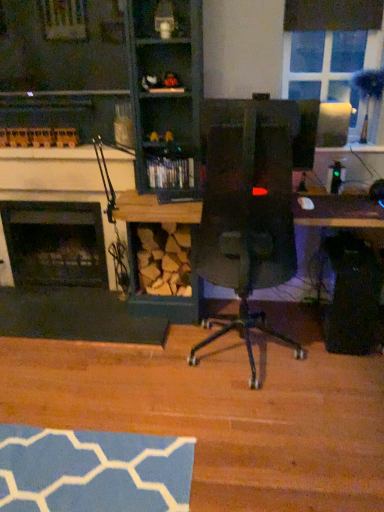
Question: From a real-world perspective, is black matte fireplace at left, the 1th fireplace from the back, above or below wooden shelf at upper center, the 2th shelf ordered from the bottom?

Choices:
 (A) below
 (B) above

Answer: (A)

Question: Considering the positions of black matte fireplace at left, the 1th fireplace from the back, and wooden shelf at upper center, the first shelf viewed from the top, in the image, is black matte fireplace at left, the 1th fireplace from the back, taller or shorter than wooden shelf at upper center, the first shelf viewed from the top,?

Choices:
 (A) tall
 (B) short

Answer: (A)

Question: Based on their relative distances, which object is farther from the wooden shelf at upper center, the first shelf viewed from the top?

Choices:
 (A) wooden fireplace at left
 (B) black glass fireplace at left, which appears as the first fireplace when viewed from the front
 (C) black matte fireplace at left, marked as the 2th fireplace in a front-to-back arrangement
 (D) wooden shelf at center, the second shelf positioned from the front
 (E) clear glass window at upper right

Answer: (C)

Question: Estimate the real-world distances between objects in this image. Which object is closer to the wooden fireplace at left?

Choices:
 (A) wooden shelf at upper center, the 2th shelf ordered from the bottom
 (B) clear glass window at upper right
 (C) wooden shelf at center, which is counted as the first shelf, starting from the back
 (D) black glass fireplace at left, which appears as the first fireplace when viewed from the front
 (E) black matte fireplace at left, marked as the 2th fireplace in a front-to-back arrangement

Answer: (A)